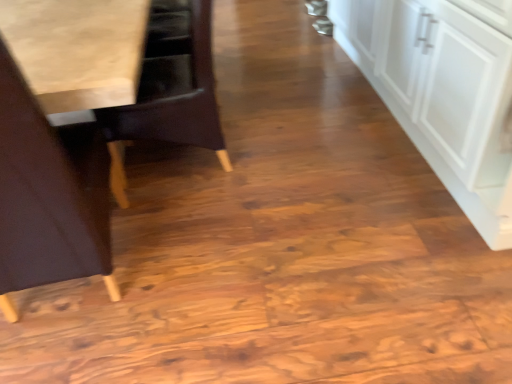
Find the location of a particular element. The image size is (512, 384). vacant area that lies between light brown wood chair at left, arranged as the first chair when viewed from the front, and wooden chair at left, positioned as the first chair in back-to-front order is located at coordinates (174, 226).